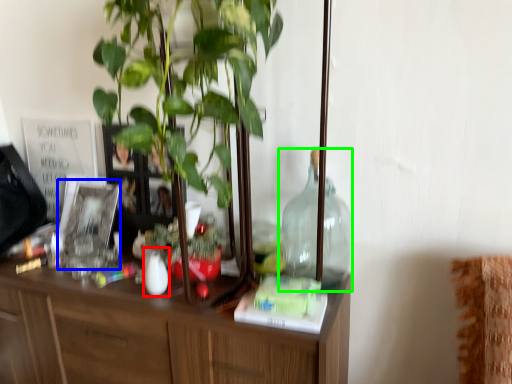
Question: Estimate the real-world distances between objects in this image. Which object is farther from vase (highlighted by a red box), picture frame (highlighted by a blue box) or bottle (highlighted by a green box)?

Choices:
 (A) picture frame
 (B) bottle

Answer: (B)